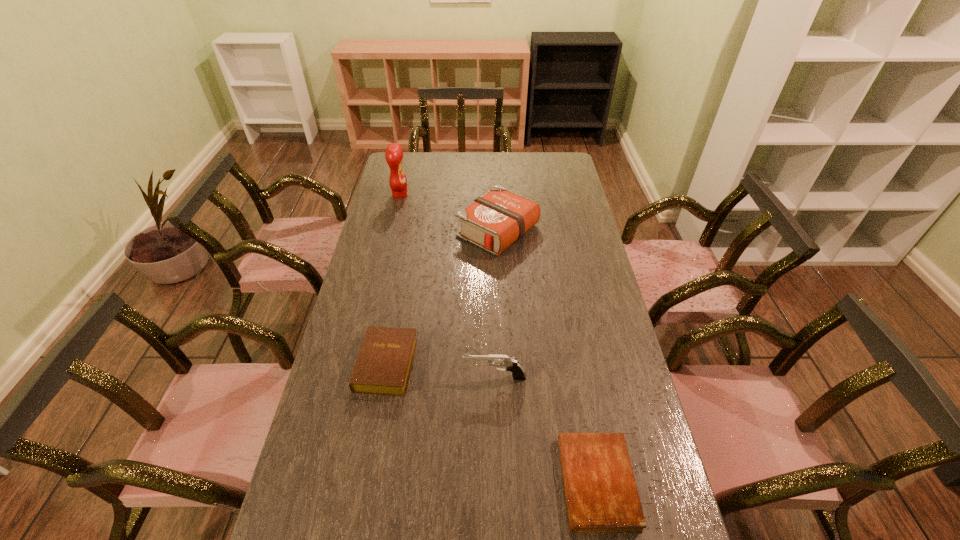
Locate an element on the screen. The height and width of the screenshot is (540, 960). free point that satisfies the following two spatial constraints: 1. on the label side of the condiment; 2. on the right side of the second farthest object is located at coordinates (392, 231).

Locate an element on the screen. vacant area that satisfies the following two spatial constraints: 1. on the front side of the fourth nearest object; 2. at the muzzle of the gun is located at coordinates (505, 377).

Where is `vacant space that satisfies the following two spatial constraints: 1. on the label side of the leftmost Bible; 2. on the left side of the condiment`? The image size is (960, 540). vacant space that satisfies the following two spatial constraints: 1. on the label side of the leftmost Bible; 2. on the left side of the condiment is located at coordinates (361, 364).

Where is `free point that satisfies the following two spatial constraints: 1. on the back side of the farthest Bible; 2. on the label side of the condiment`? free point that satisfies the following two spatial constraints: 1. on the back side of the farthest Bible; 2. on the label side of the condiment is located at coordinates (496, 195).